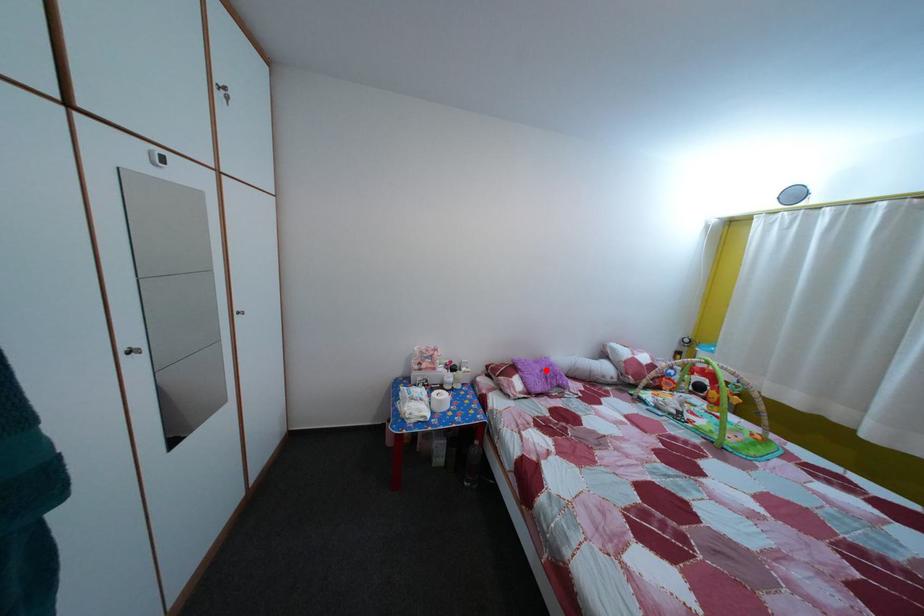
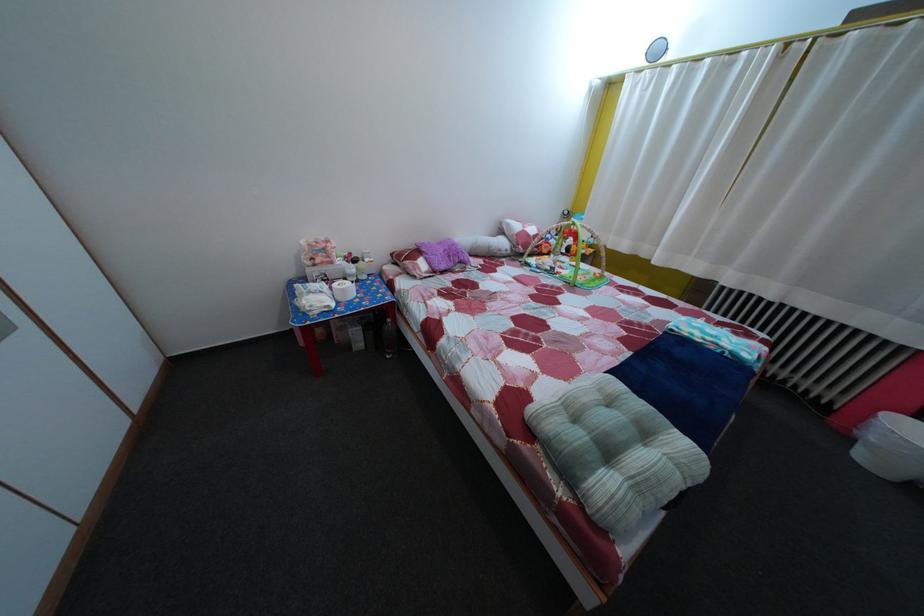
The point at the highlighted location is marked in the first image. Where is the corresponding point in the second image?

(450, 252)